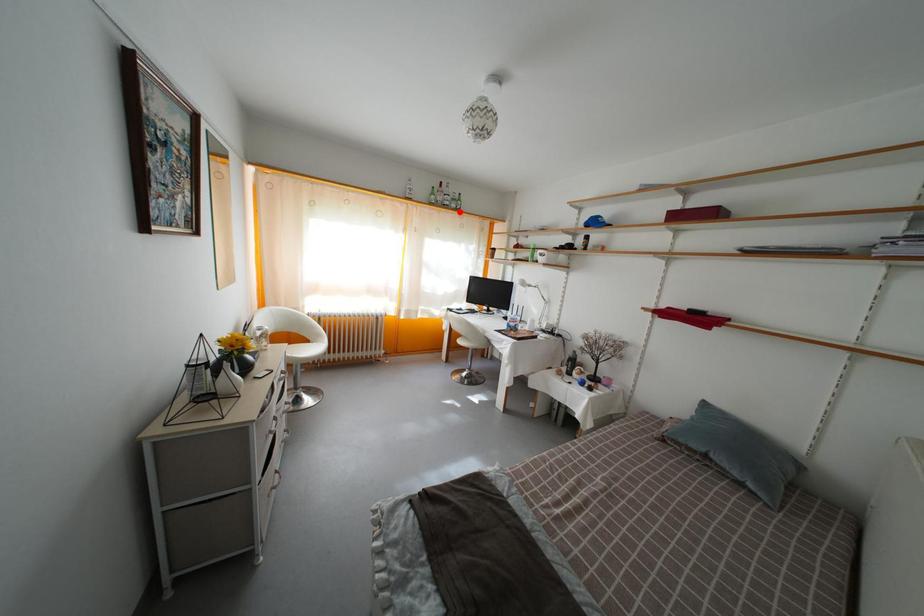
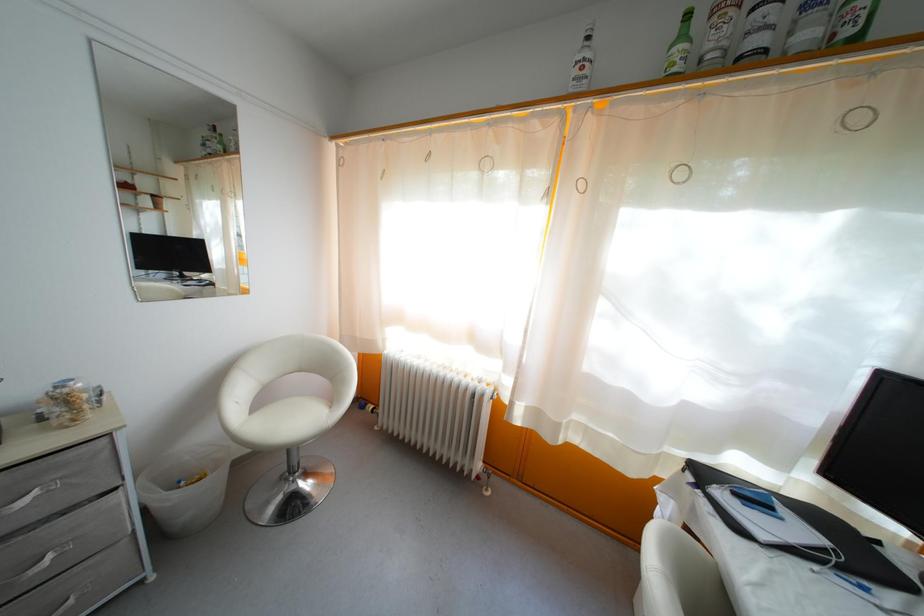
In the second image, find the point that corresponds to the highlighted location in the first image.

(812, 42)